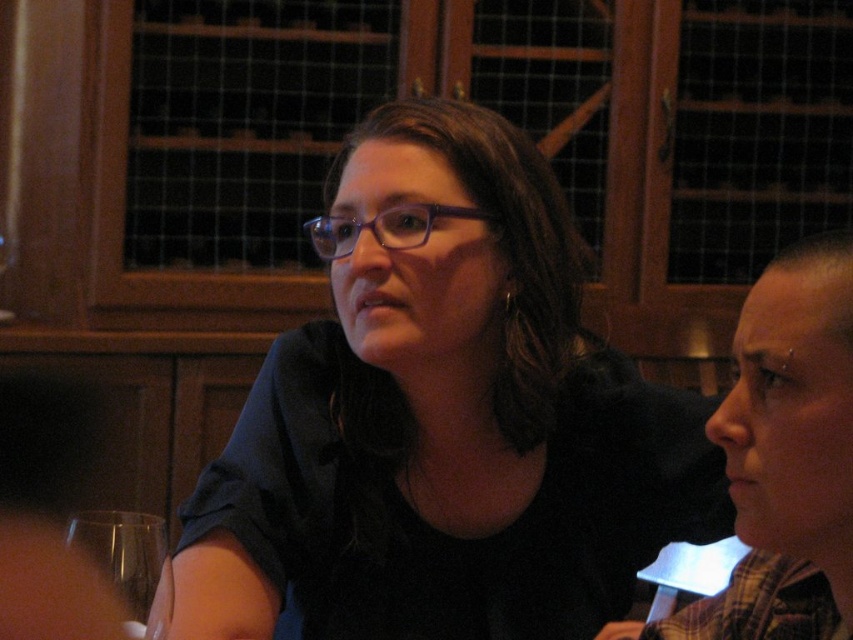
Is matte black shirt at center further to the viewer compared to transparent glass at lower left?

That is True.

Find the location of a particular element. Image resolution: width=853 pixels, height=640 pixels. matte black shirt at center is located at coordinates click(x=444, y=419).

This screenshot has width=853, height=640. I want to click on matte black shirt at center, so pos(444,419).